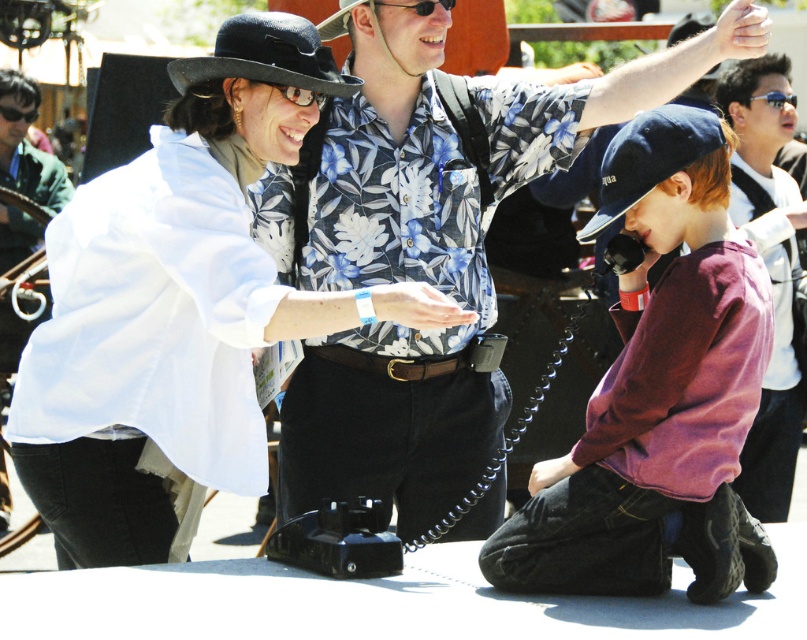
Which is more to the left, dark blue fabric cap at lower center or clear plastic goggles at center?

clear plastic goggles at center

Does dark blue fabric cap at lower center appear under clear plastic goggles at center?

Yes, dark blue fabric cap at lower center is below clear plastic goggles at center.

Is point (684, 112) more distant than point (283, 86)?

Yes.

The image size is (807, 640). Identify the location of dark blue fabric cap at lower center. (650, 157).

Does white matte shirt at upper left appear over black plastic goggles at upper left?

No, white matte shirt at upper left is not above black plastic goggles at upper left.

Consider the image. Is white matte shirt at upper left positioned before black plastic goggles at upper left?

That is True.

Image resolution: width=807 pixels, height=640 pixels. Find the location of `white matte shirt at upper left`. white matte shirt at upper left is located at coordinates (178, 305).

Locate an element on the screen. Image resolution: width=807 pixels, height=640 pixels. white matte shirt at upper left is located at coordinates (178, 305).

Who is positioned more to the right, floral shirt at center or dark blue fabric cap at lower center?

Positioned to the right is dark blue fabric cap at lower center.

Who is positioned more to the left, floral shirt at center or dark blue fabric cap at lower center?

floral shirt at center

Is point (312, 372) farther from camera compared to point (714, 122)?

That is True.

Locate an element on the screen. floral shirt at center is located at coordinates (424, 248).